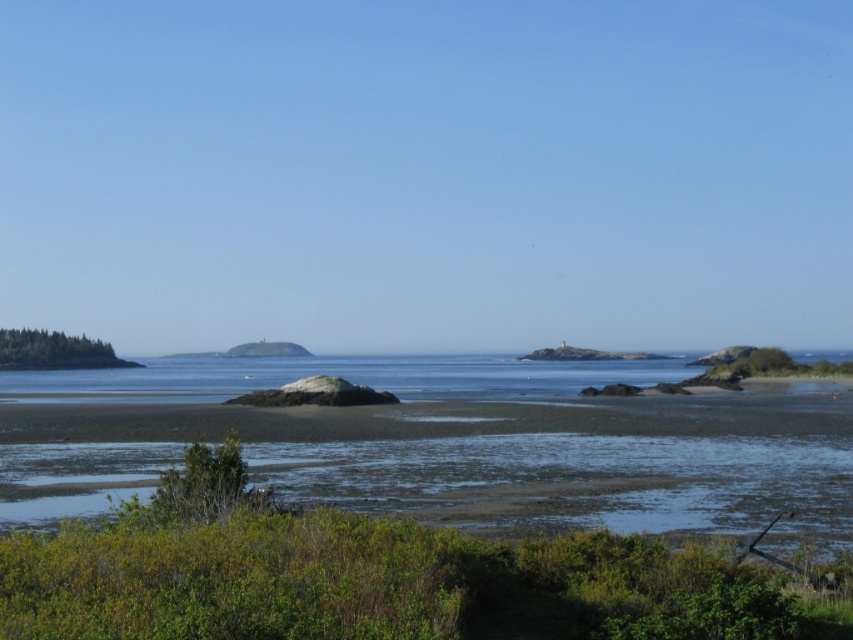
Consider the image. You are standing at the point marked as point [457,452]. What do you see directly in front of you?

You see the green grassy beach at lower center directly in front of you.

You are standing on the green grassy beach at lower center and want to reach the green grassy island at left. Which direction should you walk to get there?

You should walk to the left to reach the green grassy island at left from the green grassy beach at lower center since the green grassy beach at lower center is positioned to the right of the green grassy island at left according to the description.

You are standing at the edge of the green grassy beach at lower center and want to reach the prominent rock formation in the midground. According to the coordinates provided, in which direction should you move relative to your current position?

The green grassy beach at lower center is located at point (457, 452). Since the rock formation is in the midground, which is between the foreground and background, you should move forward from the green grassy beach at lower center towards the midground to reach the rock formation.